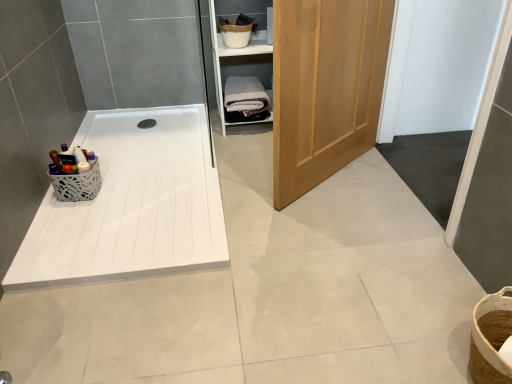
This screenshot has height=384, width=512. In order to click on vacant space situated above white glossy bath at left (from a real-world perspective) in this screenshot , I will do `click(141, 159)`.